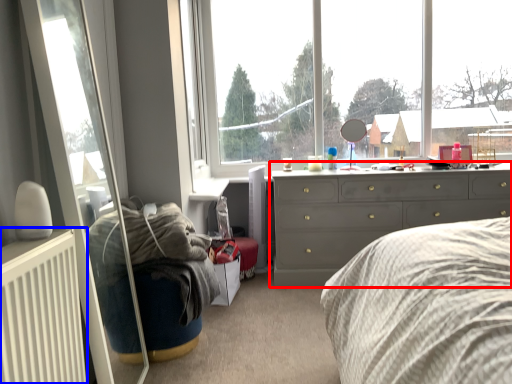
Question: Among these objects, which one is farthest to the camera, chest of drawers (highlighted by a red box) or radiator (highlighted by a blue box)?

Choices:
 (A) chest of drawers
 (B) radiator

Answer: (A)